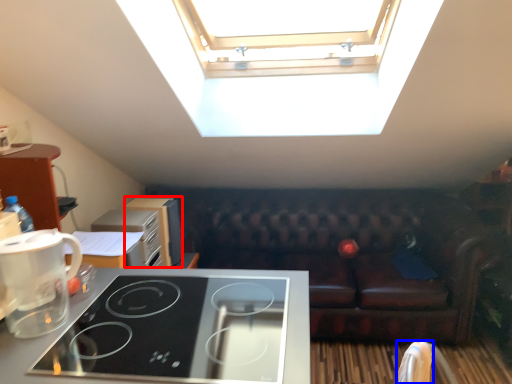
Question: Which point is closer to the camera, appliance (highlighted by a red box) or armchair (highlighted by a blue box)?

Choices:
 (A) appliance
 (B) armchair

Answer: (B)